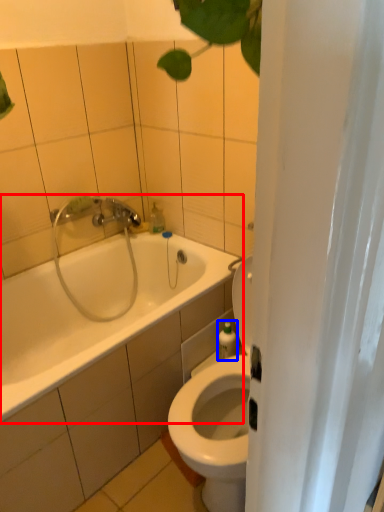
Question: Among these objects, which one is farthest to the camera, bathtub (highlighted by a red box) or toiletry (highlighted by a blue box)?

Choices:
 (A) bathtub
 (B) toiletry

Answer: (B)